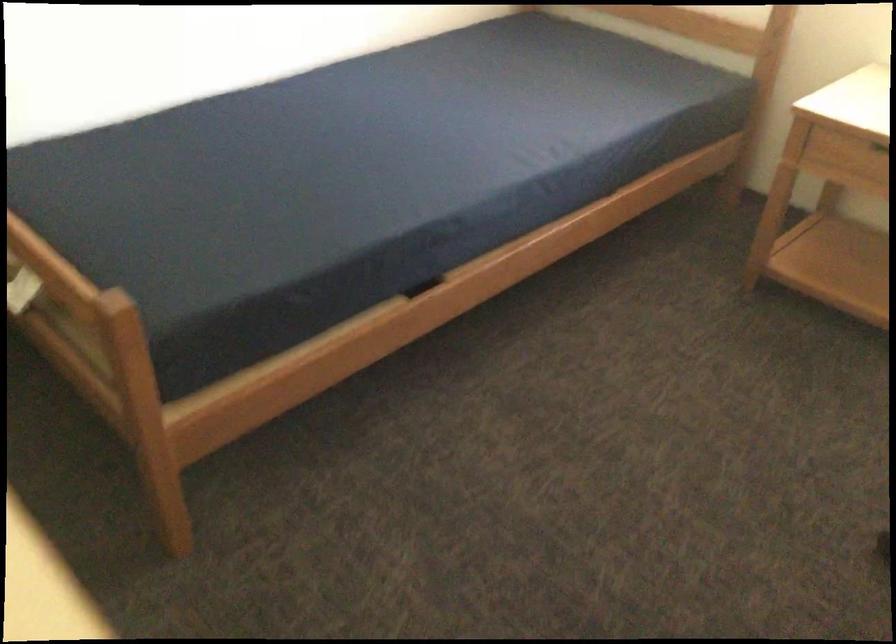
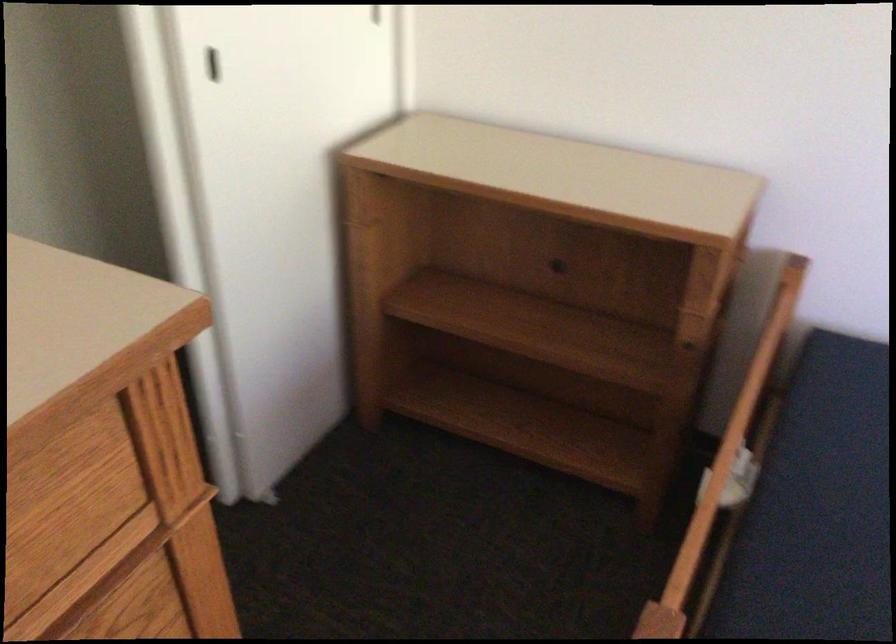
In the second image, find the point that corresponds to point (82, 222) in the first image.

(846, 480)